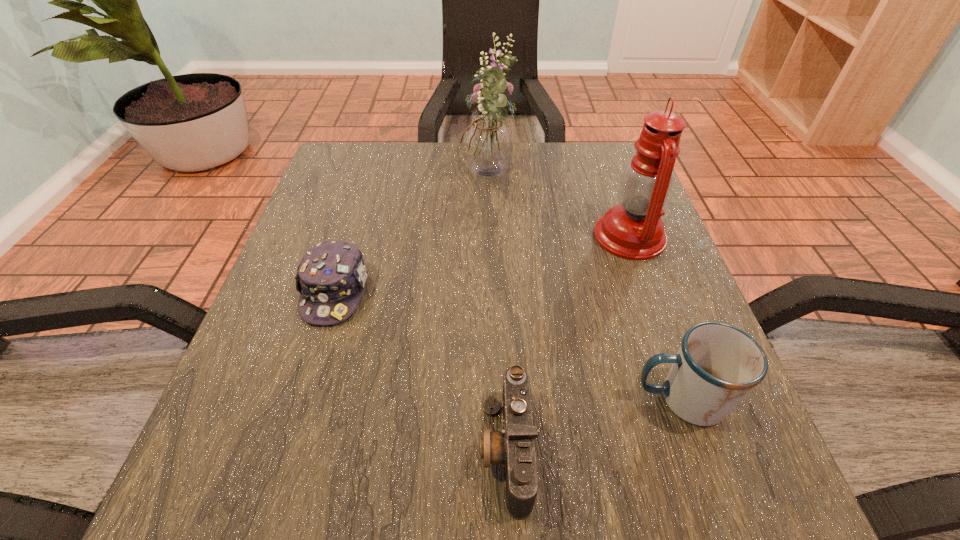
Identify the location of mug at the right edge. This screenshot has width=960, height=540. (717, 365).

Where is `vacant point at the far edge`? vacant point at the far edge is located at coordinates (566, 179).

In the image, there is a desktop. Where is `free space at the near edge`? This screenshot has width=960, height=540. free space at the near edge is located at coordinates (504, 485).

Where is `vacant region at the left edge of the desktop`? vacant region at the left edge of the desktop is located at coordinates (348, 219).

In the image, there is a desktop. What are the coordinates of `vacant space at the right edge` in the screenshot? It's located at (618, 266).

This screenshot has width=960, height=540. In the image, there is a desktop. What are the coordinates of `blank space at the far left corner` in the screenshot? It's located at (348, 144).

In the image, there is a desktop. In order to click on vacant area at the near left corner in this screenshot , I will do `click(189, 482)`.

Find the location of `vacant space at the far right corner`. vacant space at the far right corner is located at coordinates pyautogui.click(x=583, y=154).

Locate an element on the screen. The image size is (960, 540). free spot at the near right corner of the desktop is located at coordinates (646, 454).

At what (x,y) coordinates should I click in order to perform the action: click on free space between the oil lamp and the headwear. Please return your answer as a coordinate pair (x, y). Looking at the image, I should click on (483, 264).